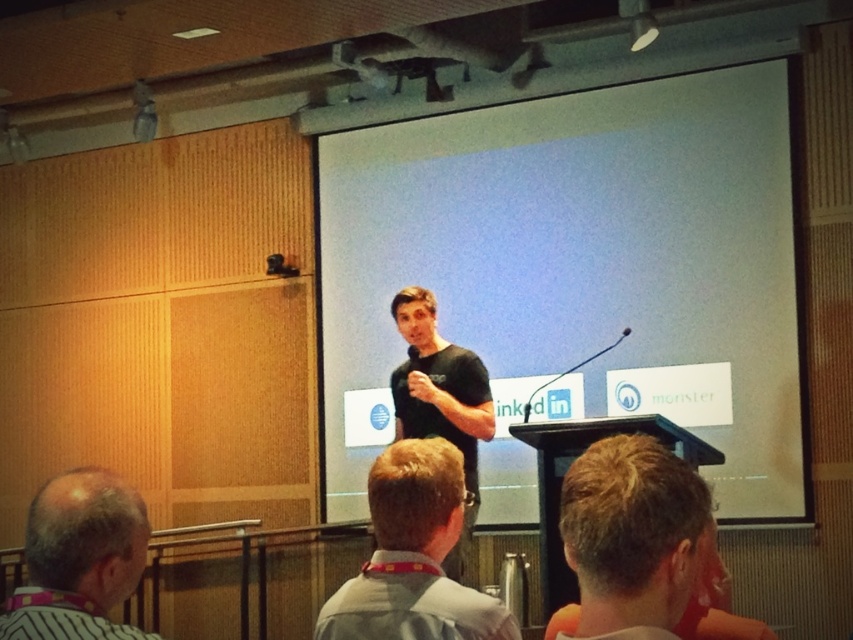
Question: Which of the following is the closest to the observer?

Choices:
 (A) blonde hair at upper center
 (B) gray striped shirt at lower left
 (C) light brown hair at center
 (D) black matte t-shirt at center

Answer: (A)

Question: Which is farther from the black matte shirt at center?

Choices:
 (A) blonde hair at upper center
 (B) light brown hair at center
 (C) black matte t-shirt at center
 (D) gray striped shirt at lower left

Answer: (D)

Question: Does blonde hair at upper center come behind black matte shirt at center?

Choices:
 (A) yes
 (B) no

Answer: (B)

Question: Is blonde hair at upper center closer to the viewer compared to black matte shirt at center?

Choices:
 (A) yes
 (B) no

Answer: (A)

Question: Considering the relative positions of black matte t-shirt at center and blonde hair at upper center in the image provided, where is black matte t-shirt at center located with respect to blonde hair at upper center?

Choices:
 (A) right
 (B) left

Answer: (A)

Question: Which point is farther to the camera?

Choices:
 (A) (465, 529)
 (B) (341, 612)
 (C) (583, 464)

Answer: (A)